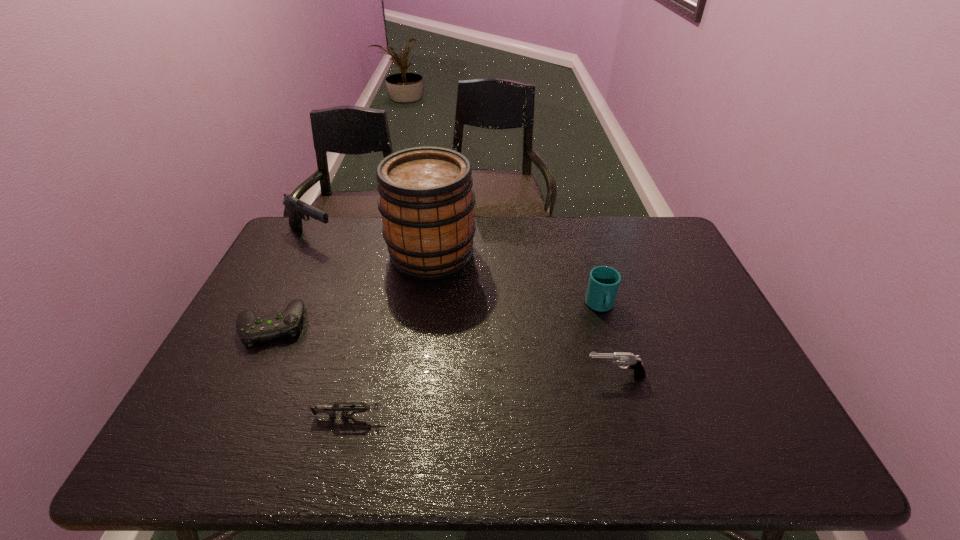
The height and width of the screenshot is (540, 960). I want to click on control that is at the left edge, so click(251, 329).

The width and height of the screenshot is (960, 540). What are the coordinates of `object present at the far left corner` in the screenshot? It's located at (297, 209).

Find the location of `free space at the far edge of the desktop`. free space at the far edge of the desktop is located at coordinates (534, 235).

In the image, there is a desktop. Where is `vacant space at the near edge`? The width and height of the screenshot is (960, 540). vacant space at the near edge is located at coordinates (372, 442).

Image resolution: width=960 pixels, height=540 pixels. I want to click on free spot at the left edge of the desktop, so click(228, 369).

Locate an element on the screen. The width and height of the screenshot is (960, 540). vacant point at the right edge is located at coordinates (x=654, y=264).

Find the location of a particular element. vacant area at the near left corner is located at coordinates [x=183, y=433].

Where is `free space at the far right corner of the desktop`? This screenshot has width=960, height=540. free space at the far right corner of the desktop is located at coordinates [648, 227].

This screenshot has height=540, width=960. I want to click on vacant area between the nearest object and the rightmost gun, so click(x=484, y=396).

The height and width of the screenshot is (540, 960). Find the location of `empty space between the nearest object and the cider`. empty space between the nearest object and the cider is located at coordinates (392, 335).